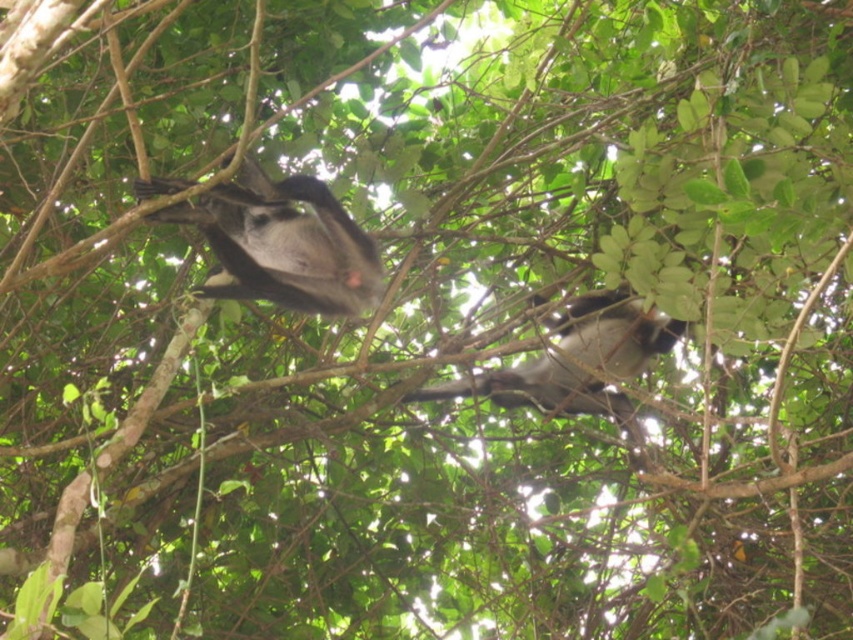
You are a wildlife photographer trying to capture a photo of both monkeys. You notice that the gray furry monkey at upper center and the gray furry monkey at center are at different heights. Which monkey is positioned higher in the tree?

The gray furry monkey at upper center is positioned higher in the tree than the gray furry monkey at center.